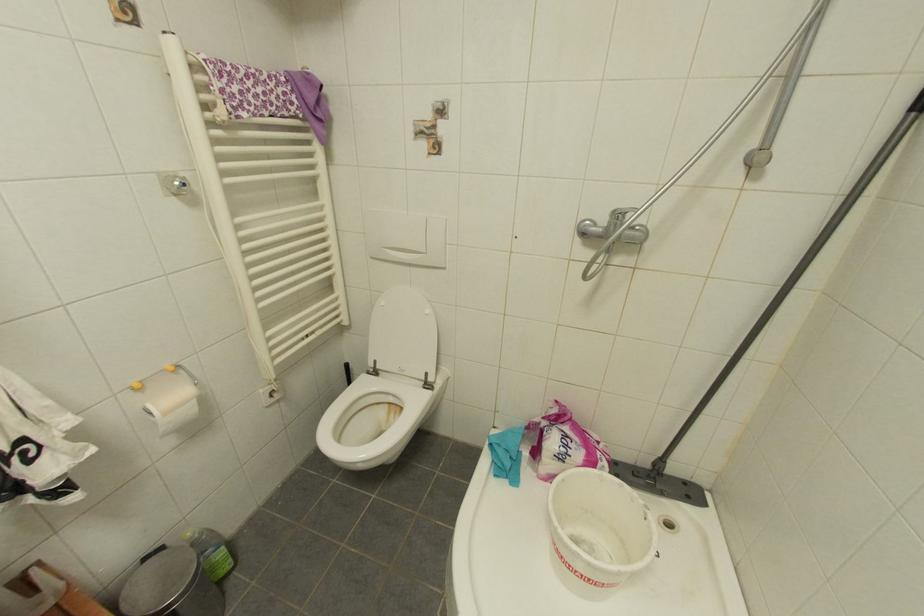
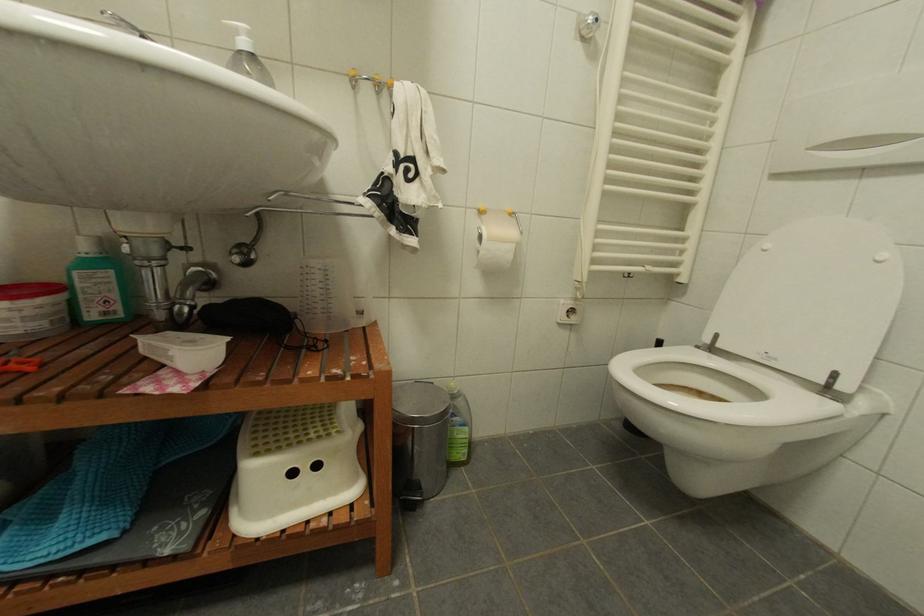
Question: The camera is either moving clockwise (left) or counter-clockwise (right) around the object. The first image is from the beginning of the video and the second image is from the end. Is the camera moving left or right when shooting the video?

Choices:
 (A) Left
 (B) Right

Answer: (B)